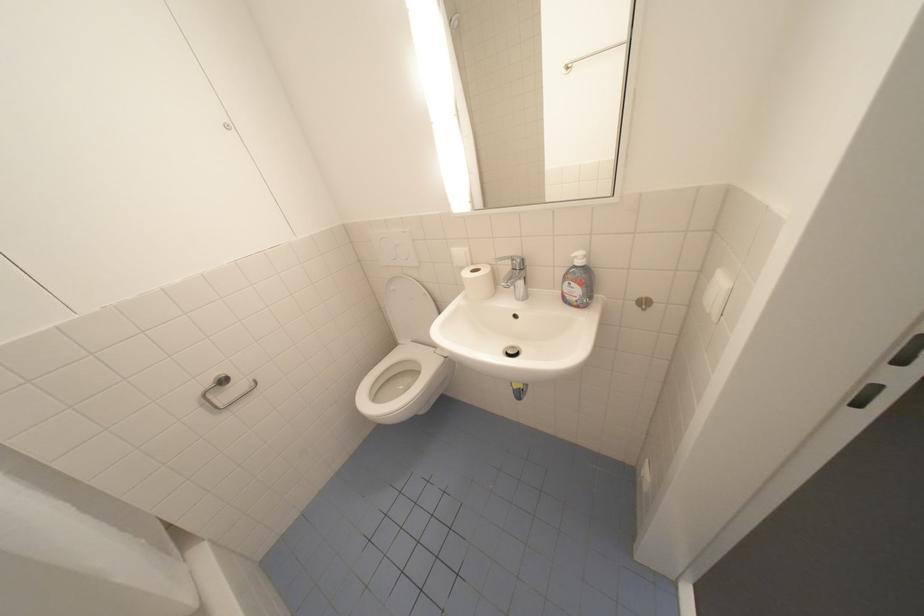
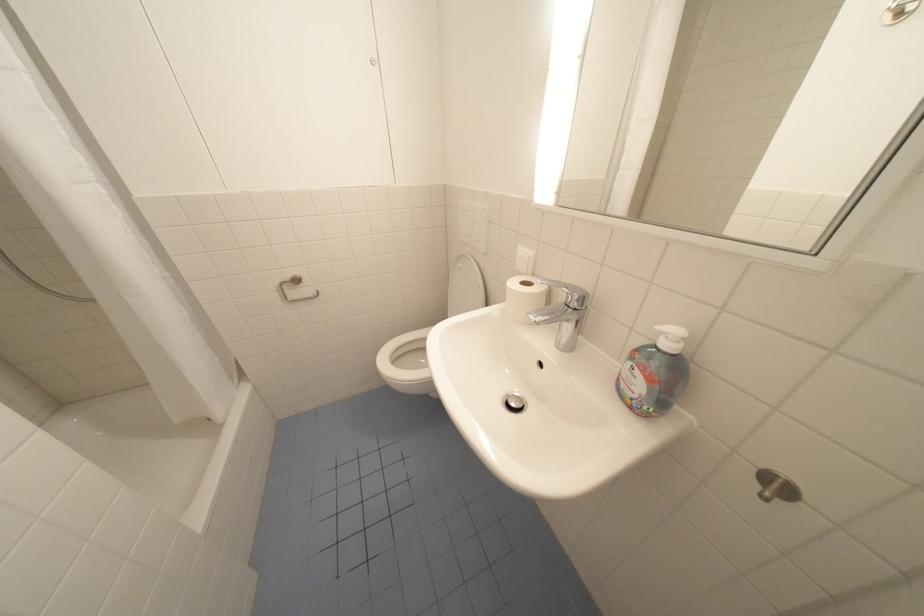
Locate, in the second image, the point that corresponds to (x=408, y=268) in the first image.

(480, 248)